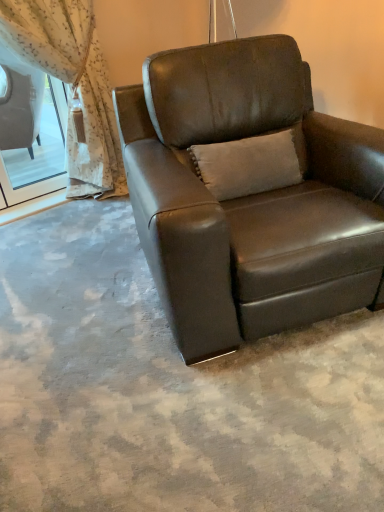
Question: From a real-world perspective, relative to suede beige pillow at center, is sheer floral fabric at upper left vertically above or below?

Choices:
 (A) below
 (B) above

Answer: (B)

Question: From the image's perspective, is sheer floral fabric at upper left above or below suede beige pillow at center?

Choices:
 (A) above
 (B) below

Answer: (A)

Question: Which object is positioned farthest from the sheer floral fabric at upper left?

Choices:
 (A) brown leather chair at center
 (B) suede beige pillow at center

Answer: (B)

Question: Considering the real-world distances, which object is farthest from the suede beige pillow at center?

Choices:
 (A) brown leather chair at center
 (B) sheer floral fabric at upper left

Answer: (B)